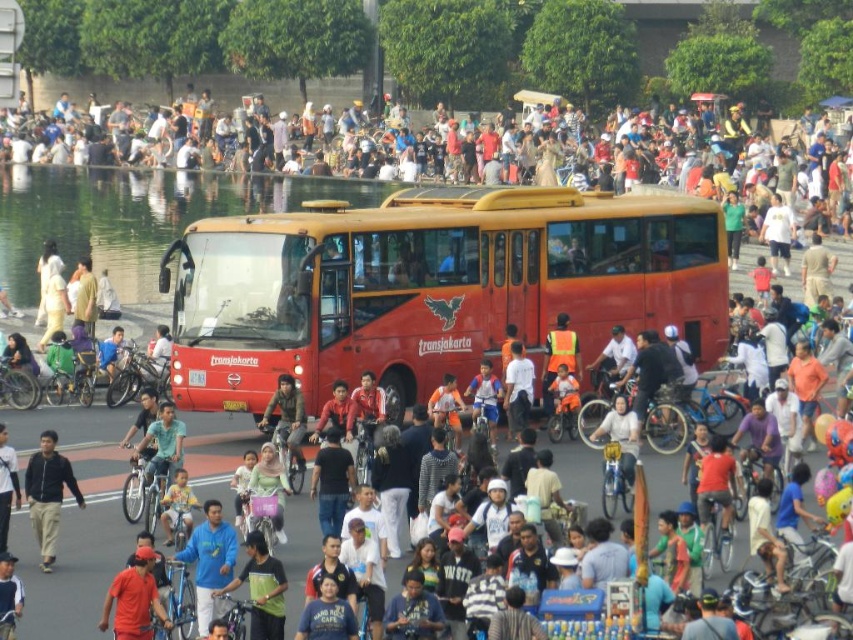
Can you confirm if dark blue shirt at center is positioned above jeans at center?

No, dark blue shirt at center is not above jeans at center.

The width and height of the screenshot is (853, 640). In order to click on dark blue shirt at center in this screenshot , I will do `click(260, 588)`.

Which is behind, point (251, 536) or point (300, 451)?

The point (300, 451) is more distant.

The image size is (853, 640). Find the location of `dark blue shirt at center`. dark blue shirt at center is located at coordinates (260, 588).

Who is positioned more to the left, matte black jacket at center or jeans at center?

matte black jacket at center is more to the left.

Locate an element on the screen. matte black jacket at center is located at coordinates (48, 493).

Find the location of `matte black jacket at center`. matte black jacket at center is located at coordinates (48, 493).

Who is taller, orange fabric shirt at lower left or dark blue shirt at center?

With more height is dark blue shirt at center.

Between orange fabric shirt at lower left and dark blue shirt at center, which one is positioned higher?

Positioned higher is dark blue shirt at center.

The image size is (853, 640). What do you see at coordinates (134, 600) in the screenshot?
I see `orange fabric shirt at lower left` at bounding box center [134, 600].

Where is `orange fabric shirt at lower left`? Image resolution: width=853 pixels, height=640 pixels. orange fabric shirt at lower left is located at coordinates coord(134,600).